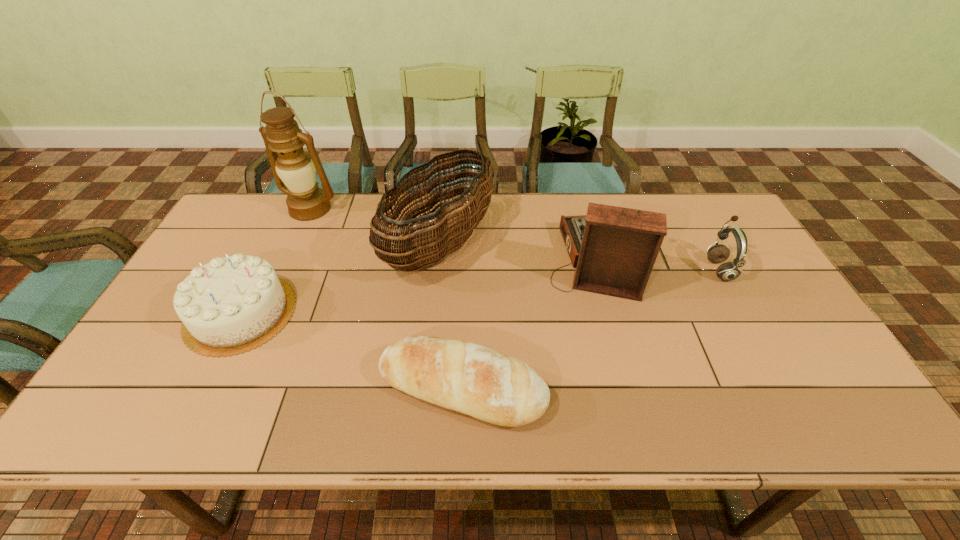
Locate an element on the screen. The height and width of the screenshot is (540, 960). vacant area that lies between the basket and the second object from right to left is located at coordinates (519, 252).

The image size is (960, 540). I want to click on unoccupied area between the phonograph record and the birthday cake, so click(x=420, y=286).

Where is `vacant space that's between the birthday cake and the bread`? The height and width of the screenshot is (540, 960). vacant space that's between the birthday cake and the bread is located at coordinates (351, 350).

The width and height of the screenshot is (960, 540). In order to click on vacant space that's between the earphone and the tallest object in this screenshot , I will do `click(515, 239)`.

Find the location of a particular element. The width and height of the screenshot is (960, 540). free spot between the birthday cake and the second object from right to left is located at coordinates (420, 286).

Image resolution: width=960 pixels, height=540 pixels. I want to click on object that stands as the closest to the bread, so click(614, 248).

Find the location of `the fourth closest object to the basket`. the fourth closest object to the basket is located at coordinates (231, 305).

The height and width of the screenshot is (540, 960). I want to click on free space that satisfies the following two spatial constraints: 1. on the ear pads of the earphone; 2. on the front side of the bread, so click(783, 387).